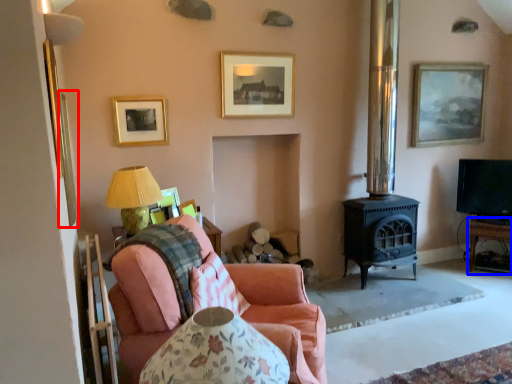
Question: Which object appears farthest to the camera in this image, picture frame (highlighted by a red box) or table (highlighted by a blue box)?

Choices:
 (A) picture frame
 (B) table

Answer: (B)